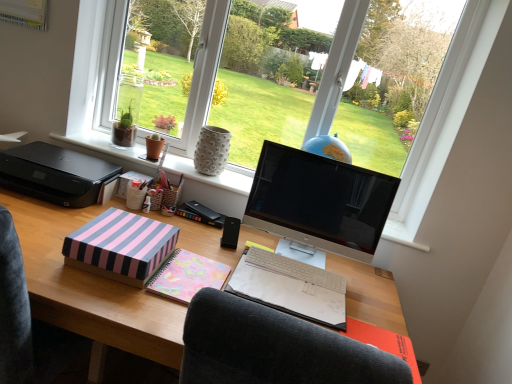
Where is `vacant area that is in front of pastel butterfly-patterned paper at center`? The image size is (512, 384). vacant area that is in front of pastel butterfly-patterned paper at center is located at coordinates (148, 309).